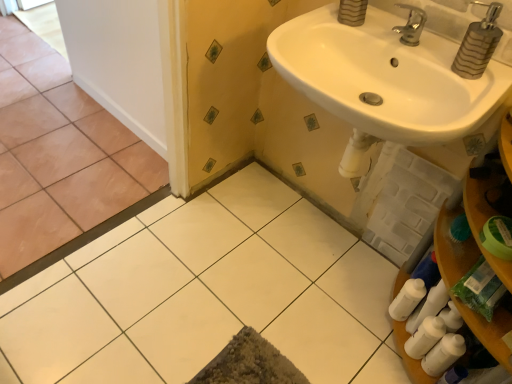
Identify the location of vacant space that is to the left of metallic striped soap dispenser at upper right. This screenshot has width=512, height=384. (420, 54).